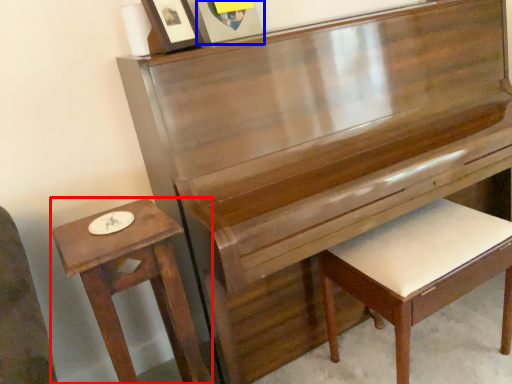
Question: Which object appears closest to the camera in this image, table (highlighted by a red box) or picture frame (highlighted by a blue box)?

Choices:
 (A) table
 (B) picture frame

Answer: (A)